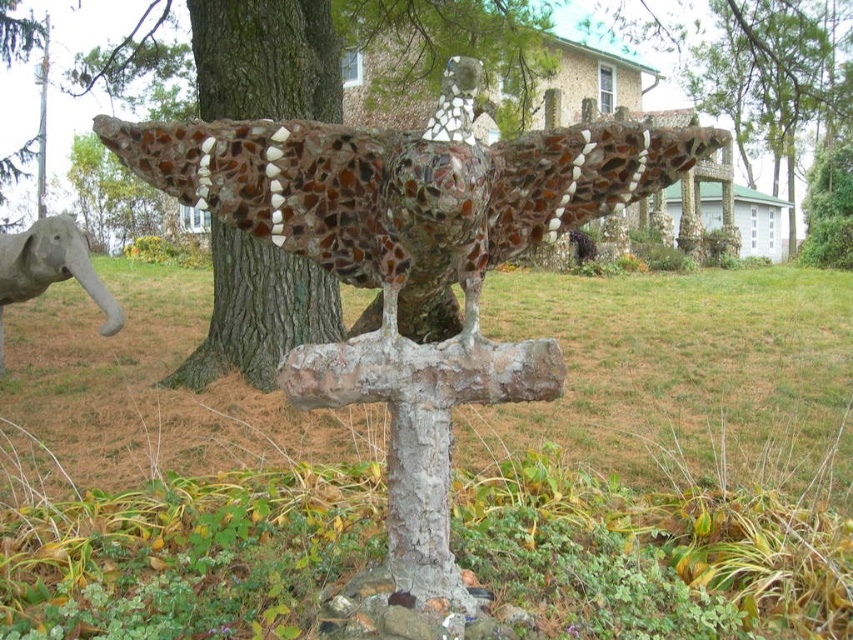
Question: Which object is positioned closest to the brown rough bark at center?

Choices:
 (A) mosaic stone bird at center
 (B) mosaic glass bird at center

Answer: (A)

Question: Can you confirm if mosaic stone bird at center is bigger than brown rough bark at center?

Choices:
 (A) yes
 (B) no

Answer: (A)

Question: Considering the relative positions of mosaic glass bird at center and mosaic stone bird at center in the image provided, where is mosaic glass bird at center located with respect to mosaic stone bird at center?

Choices:
 (A) right
 (B) left

Answer: (A)

Question: Which point is farther to the camera?

Choices:
 (A) (430, 472)
 (B) (24, 269)
 (C) (202, 346)

Answer: (C)

Question: Based on their relative distances, which object is nearer to the gray stone elephant at lower left?

Choices:
 (A) brown rough bark at center
 (B) mosaic stone bird at center

Answer: (A)

Question: Can you confirm if mosaic stone bird at center is thinner than gray stone elephant at lower left?

Choices:
 (A) yes
 (B) no

Answer: (B)